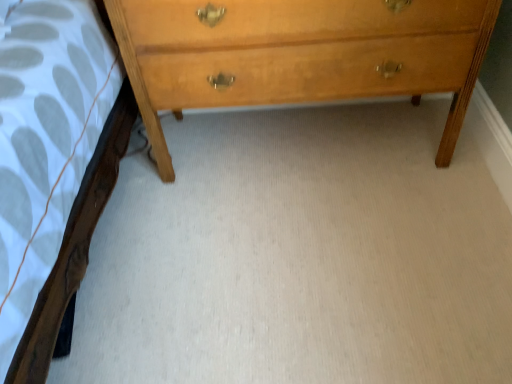
Find the location of a particular element. The height and width of the screenshot is (384, 512). free point in front of light brown wood chest of drawers at upper center is located at coordinates (313, 258).